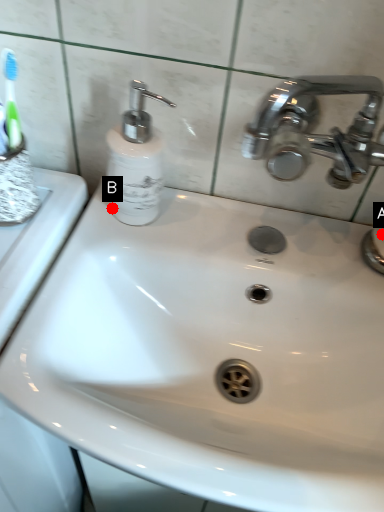
Question: Two points are circled on the image, labeled by A and B beside each circle. Which of the following is the closest to the observer?

Choices:
 (A) A is closer
 (B) B is closer

Answer: (B)